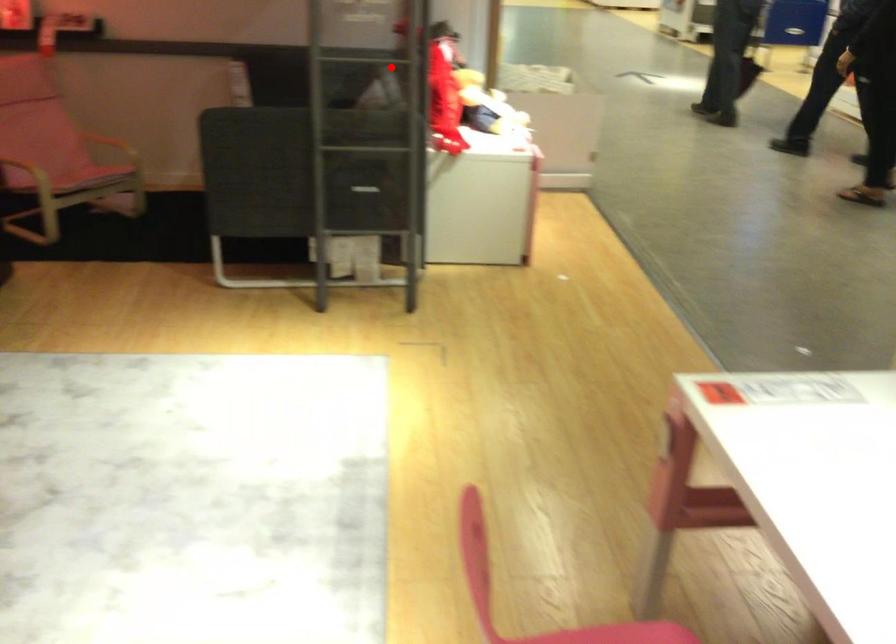
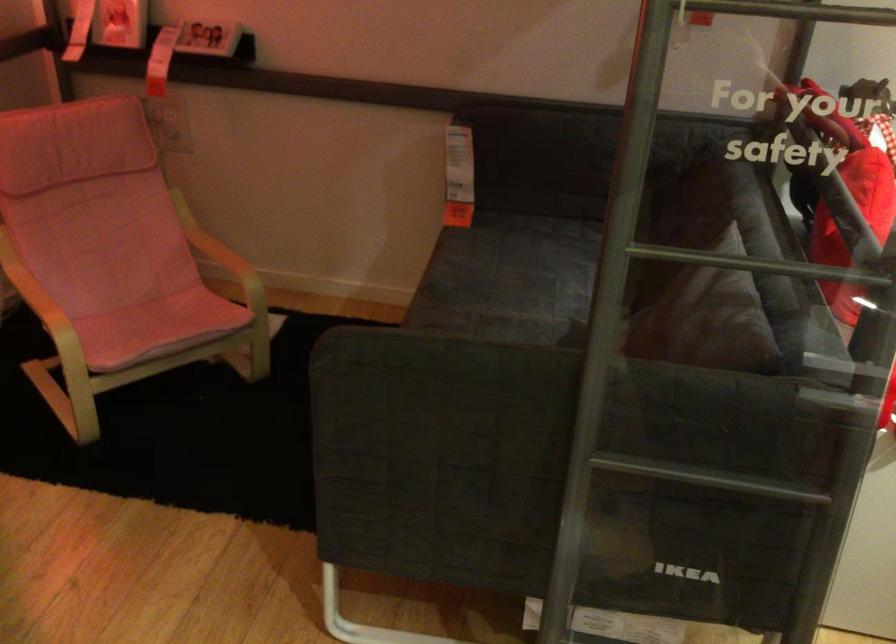
Where in the second image is the point corresponding to the highlighted location from the first image?

(760, 263)